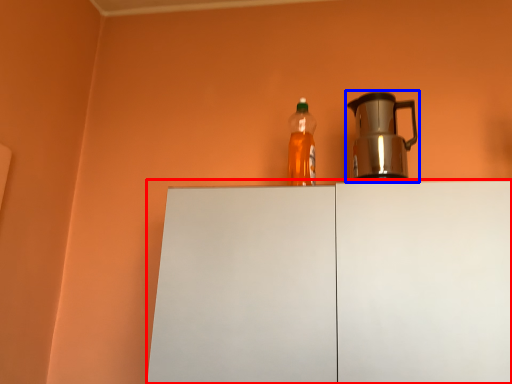
Question: Which object appears closest to the camera in this image, cabinetry (highlighted by a red box) or kettle (highlighted by a blue box)?

Choices:
 (A) cabinetry
 (B) kettle

Answer: (A)